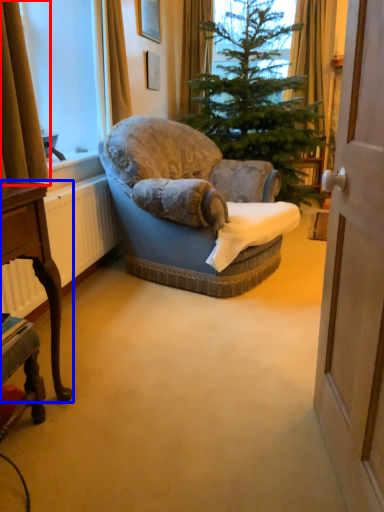
Question: Among these objects, which one is nearest to the camera, curtain (highlighted by a red box) or desk (highlighted by a blue box)?

Choices:
 (A) curtain
 (B) desk

Answer: (B)